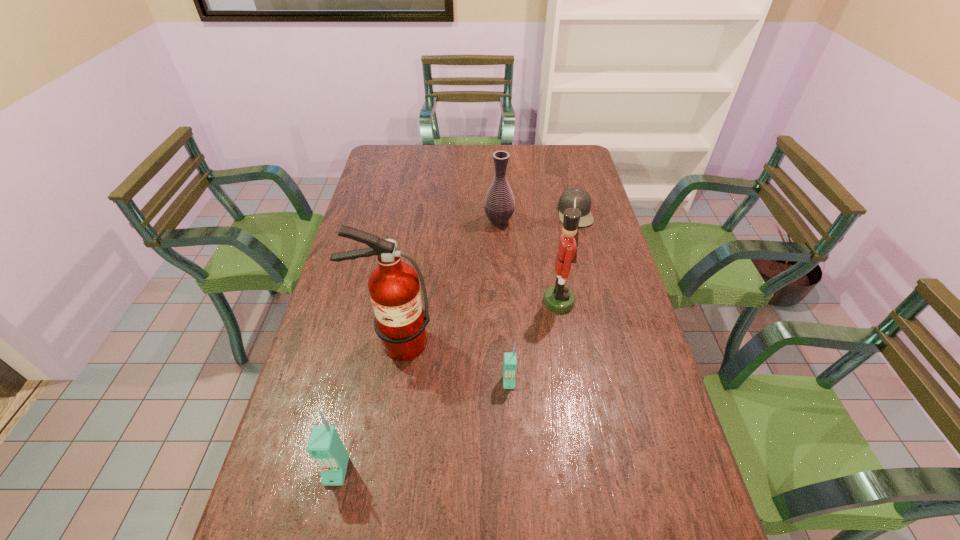
Where is `the fourth tallest object`? the fourth tallest object is located at coordinates (324, 445).

At what (x,y) coordinates should I click in order to perform the action: click on the nearest object. Please return your answer as a coordinate pair (x, y). This screenshot has width=960, height=540. Looking at the image, I should click on (324, 445).

What are the coordinates of `the second nearest object` in the screenshot? It's located at (510, 359).

I want to click on the farther cellular telephone, so click(510, 359).

You are a GUI agent. You are given a task and a screenshot of the screen. Output one action in this format:
    pyautogui.click(x=<x>, y=<y>)
    Task: Click on the vase
    This screenshot has height=540, width=960.
    Given the screenshot: What is the action you would take?
    pyautogui.click(x=499, y=204)

Identify the location of the fourth farthest object. (400, 320).

Where is `the rightmost object`? The image size is (960, 540). the rightmost object is located at coordinates (583, 200).

What are the coordinates of `the shortest object` in the screenshot? It's located at (583, 200).

This screenshot has height=540, width=960. I want to click on the fourth nearest object, so click(558, 298).

Locate an element on the screen. This screenshot has width=960, height=540. the second object from right to left is located at coordinates (558, 298).